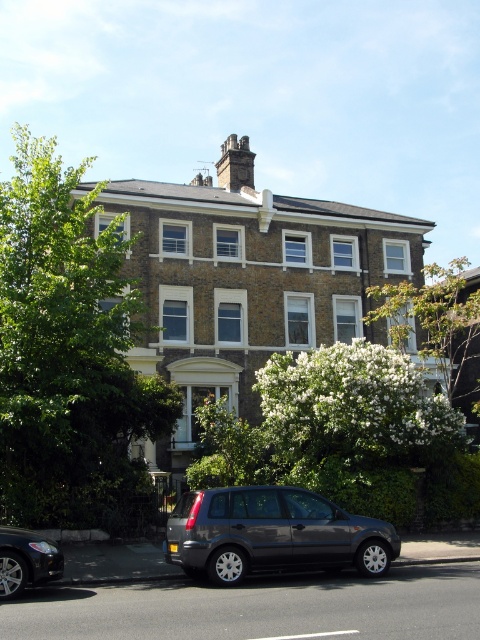
Does dark gray metallic car at lower left appear over dark gray stone chimney at upper center?

No.

Looking at this image, who is shorter, dark gray metallic car at lower left or dark gray stone chimney at upper center?

dark gray metallic car at lower left

Is point (36, 570) positioned before point (228, 170)?

Yes.

The height and width of the screenshot is (640, 480). I want to click on dark gray metallic car at lower left, so click(25, 561).

Between green leafy tree at left and dark gray metallic car at lower left, which one has more height?

green leafy tree at left

Between point (68, 195) and point (52, 572), which one is positioned in front?

Point (52, 572) is more forward.

What are the coordinates of `green leafy tree at left` in the screenshot? It's located at (67, 352).

From the picture: Who is higher up, satin dark gray suv at lower center or dark gray stone chimney at upper center?

Positioned higher is dark gray stone chimney at upper center.

Between point (241, 577) and point (245, 138), which one is positioned behind?

Point (245, 138)

At what (x,y) coordinates should I click in order to perform the action: click on satin dark gray suv at lower center. Please return your answer as a coordinate pair (x, y). This screenshot has width=480, height=640. Looking at the image, I should click on (272, 534).